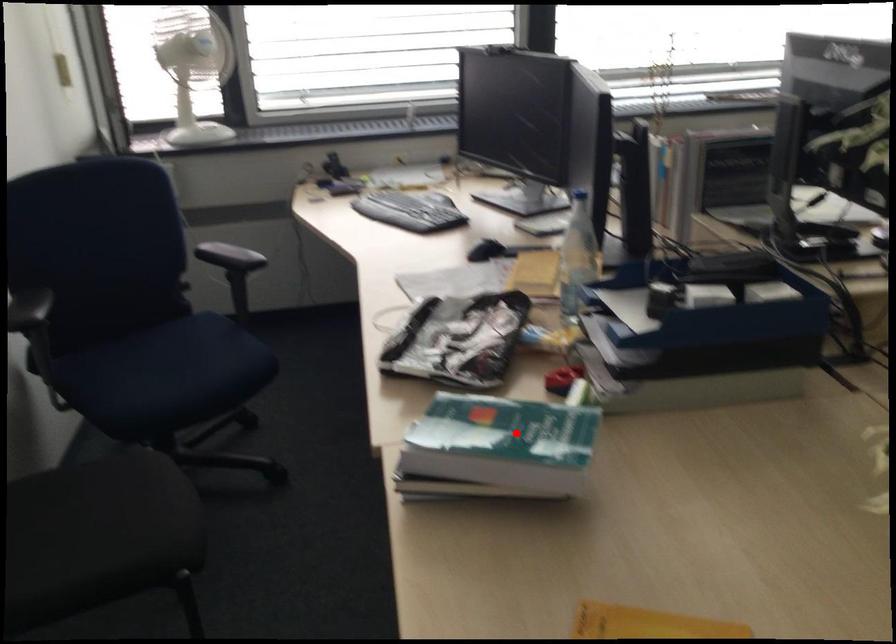
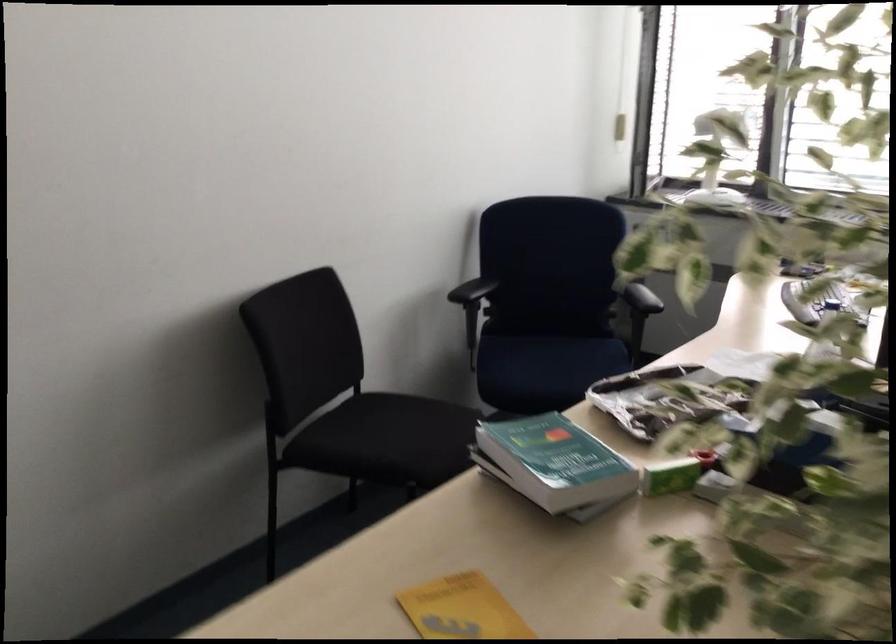
Locate, in the second image, the point that corresponds to the highlighted location in the first image.

(554, 462)